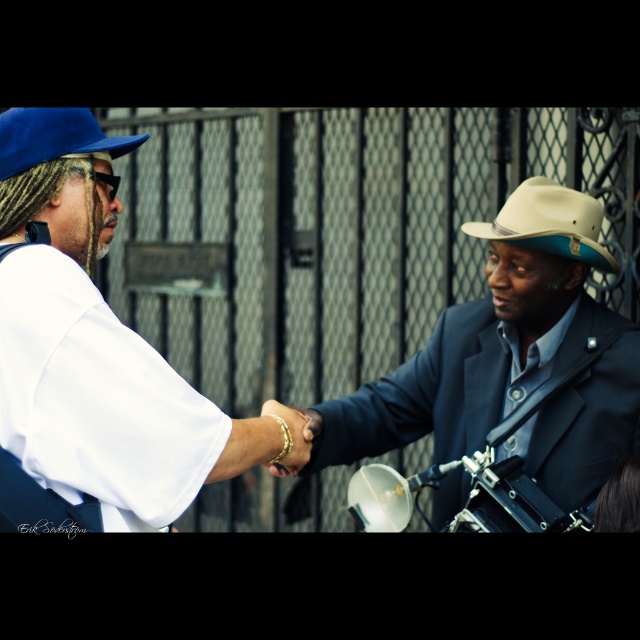
Question: Which point is closer to the camera taking this photo?

Choices:
 (A) (296, 474)
 (B) (42, 394)
 (C) (548, 237)
 (D) (134, 145)

Answer: (B)

Question: Which object is positioned farthest from the blue fabric fedora at left?

Choices:
 (A) beige felt fedora at right
 (B) matte black suit at center
 (C) gold metallic bracelet at center

Answer: (B)

Question: Which point is closer to the camera taking this photo?

Choices:
 (A) (524, 186)
 (B) (307, 436)
 (C) (541, 442)
 (D) (116, 518)

Answer: (D)

Question: Can you confirm if white matte shirt at left is positioned to the left of matte black suit at center?

Choices:
 (A) yes
 (B) no

Answer: (A)

Question: Can you confirm if matte black suit at center is positioned below blue fabric fedora at left?

Choices:
 (A) yes
 (B) no

Answer: (A)

Question: Can you confirm if matte black suit at center is bigger than gold metallic bracelet at center?

Choices:
 (A) no
 (B) yes

Answer: (B)